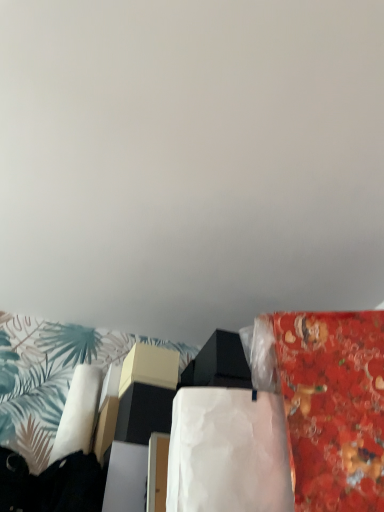
This screenshot has width=384, height=512. Describe the element at coordinates (228, 452) in the screenshot. I see `white paper at center` at that location.

Where is `white paper at center`? The width and height of the screenshot is (384, 512). white paper at center is located at coordinates (228, 452).

The image size is (384, 512). What do you see at coordinates (328, 403) in the screenshot? I see `red glossy fabric at right` at bounding box center [328, 403].

Find the location of `red glossy fabric at right`. red glossy fabric at right is located at coordinates (328, 403).

Locate an element on the screen. The width and height of the screenshot is (384, 512). white paper at center is located at coordinates (228, 452).

Which is more to the left, red glossy fabric at right or white paper at center?

white paper at center is more to the left.

Who is more distant, red glossy fabric at right or white paper at center?

Positioned behind is white paper at center.

Considering the positions of point (287, 343) and point (193, 408), is point (287, 343) closer or farther from the camera than point (193, 408)?

Point (287, 343).

From the image's perspective, is red glossy fabric at right under white paper at center?

No, from the image's perspective, red glossy fabric at right is not below white paper at center.

From a real-world perspective, which is physically above, red glossy fabric at right or white paper at center?

From a 3D spatial view, red glossy fabric at right is above.

Considering the sizes of objects red glossy fabric at right and white paper at center in the image provided, who is wider, red glossy fabric at right or white paper at center?

white paper at center.

Between red glossy fabric at right and white paper at center, which one has less height?

white paper at center is shorter.

Who is bigger, red glossy fabric at right or white paper at center?

red glossy fabric at right.

In the scene shown: Can white paper at center be found inside red glossy fabric at right?

No, white paper at center is not inside red glossy fabric at right.

Is red glossy fabric at right placed right next to white paper at center?

red glossy fabric at right is not next to white paper at center, and they're not touching.

Is red glossy fabric at right facing away from white paper at center?

red glossy fabric at right is not turned away from white paper at center.

Measure the distance from red glossy fabric at right to white paper at center.

4.99 inches.

The image size is (384, 512). In order to click on material in front of the white paper at center in this screenshot , I will do `click(328, 403)`.

Which is more to the right, white paper at center or red glossy fabric at right?

Positioned to the right is red glossy fabric at right.

Is white paper at center in front of red glossy fabric at right?

No, it is behind red glossy fabric at right.

Is point (178, 473) more distant than point (288, 392)?

No, it is in front of (288, 392).

From the image's perspective, is white paper at center beneath red glossy fabric at right?

Yes.

From a real-world perspective, between white paper at center and red glossy fabric at right, who is vertically higher?

red glossy fabric at right is physically above.

Considering the sizes of white paper at center and red glossy fabric at right in the image, is white paper at center wider or thinner than red glossy fabric at right?

white paper at center is wider than red glossy fabric at right.

In terms of height, does white paper at center look taller or shorter compared to red glossy fabric at right?

In the image, white paper at center appears to be shorter than red glossy fabric at right.

Can you confirm if white paper at center is bigger than red glossy fabric at right?

No.

Is red glossy fabric at right surrounded by white paper at center?

No, red glossy fabric at right is not a part of white paper at center.

Is white paper at center far away from red glossy fabric at right?

white paper at center is actually quite close to red glossy fabric at right.

Could you tell me if white paper at center is turned towards red glossy fabric at right?

No, white paper at center is not aimed at red glossy fabric at right.

What's the angular difference between white paper at center and red glossy fabric at right's facing directions?

The angular difference between white paper at center and red glossy fabric at right is 24.1 degrees.

How much distance is there between white paper at center and red glossy fabric at right?

The distance of white paper at center from red glossy fabric at right is 4.99 inches.

Find the location of a particular element. blanket behind the red glossy fabric at right is located at coordinates (228, 452).

The width and height of the screenshot is (384, 512). What are the coordinates of `material located in front of the white paper at center` in the screenshot? It's located at (328, 403).

Find the location of `blanket behind the red glossy fabric at right`. blanket behind the red glossy fabric at right is located at coordinates (228, 452).